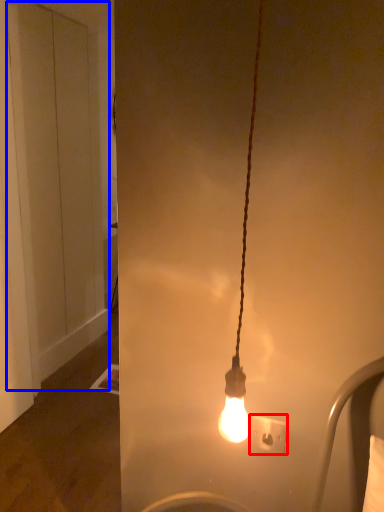
Question: Which point is further to the camera, power plugs and sockets (highlighted by a red box) or door (highlighted by a blue box)?

Choices:
 (A) power plugs and sockets
 (B) door

Answer: (B)